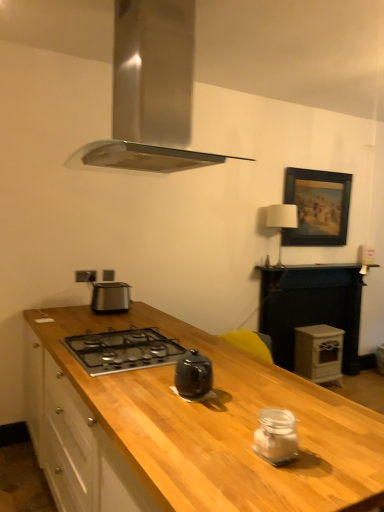
You are a GUI agent. You are given a task and a screenshot of the screen. Output one action in this format:
    pyautogui.click(x=<x>, y=<y>)
    Task: Click on the free space to the right of clear glass jar at center, which is the 2th kitchen appliance from back to front
    
    Given the screenshot: What is the action you would take?
    pyautogui.click(x=341, y=453)